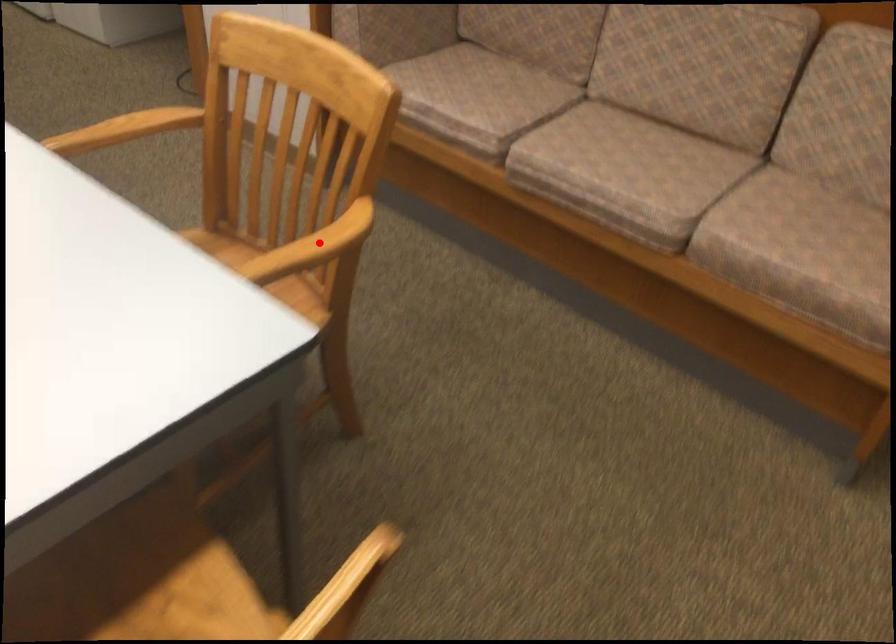
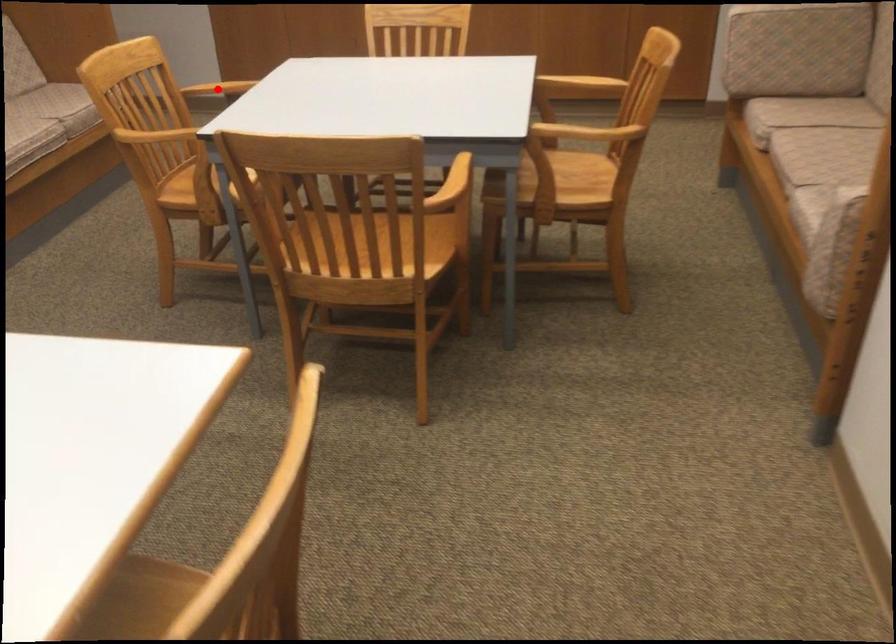
I am providing you with two images of the same scene from different viewpoints. A red point is marked on the first image and another point is marked on the second image. Does the point marked in image1 correspond to the same location as the one in image2?

Yes